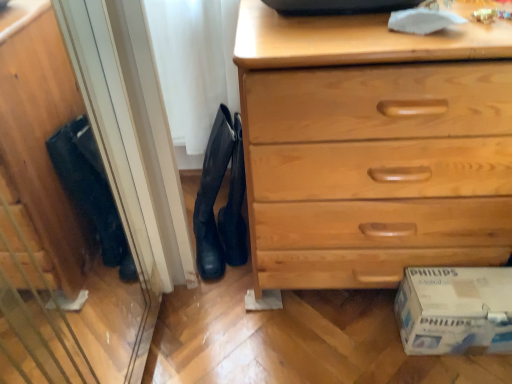
Identify the location of free space above light wood chest of drawers at lower right (from a real-world perspective). The height and width of the screenshot is (384, 512). (399, 28).